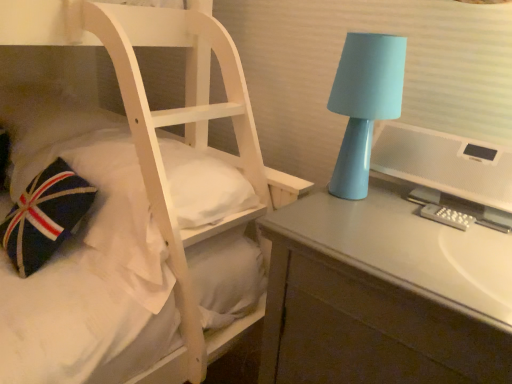
What do you see at coordinates (446, 165) in the screenshot? I see `white textured computer monitor at right` at bounding box center [446, 165].

Find the location of a particular element. white textured computer monitor at right is located at coordinates (446, 165).

Are matte gray desk at right and white textured computer monitor at right located far from each other?

No, there isn't a large distance between matte gray desk at right and white textured computer monitor at right.

Is matte gray desk at right facing towards white textured computer monitor at right?

No, matte gray desk at right is not facing towards white textured computer monitor at right.

In the image, is matte gray desk at right positioned in front of or behind white textured computer monitor at right?

matte gray desk at right is positioned closer to the viewer than white textured computer monitor at right.

Based on the photo, is matte gray desk at right inside white textured computer monitor at right?

No, matte gray desk at right is not a part of white textured computer monitor at right.

Which object is thinner, white textured computer monitor at right or matte gray desk at right?

white textured computer monitor at right.

Where is `computer monitor that appears on the right of matte gray desk at right`? computer monitor that appears on the right of matte gray desk at right is located at coordinates (446, 165).

Is matte blue lamp at right oriented towards white textured computer monitor at right?

No, matte blue lamp at right is not facing towards white textured computer monitor at right.

Which object is further away from the camera, matte blue lamp at right or white textured computer monitor at right?

Positioned behind is matte blue lamp at right.

Considering the positions of objects matte blue lamp at right and white textured computer monitor at right in the image provided, who is more to the left, matte blue lamp at right or white textured computer monitor at right?

matte blue lamp at right.

Between point (451, 170) and point (369, 75), which one is positioned in front?

Positioned in front is point (369, 75).

At what (x,y) coordinates should I click in order to perform the action: click on lamp on the left of white textured computer monitor at right. Please return your answer as a coordinate pair (x, y). Looking at the image, I should click on (364, 104).

Is white textured computer monitor at right oriented towards matte blue lamp at right?

No, white textured computer monitor at right is not turned towards matte blue lamp at right.

Between matte blue lamp at right and matte gray desk at right, which one appears on the right side from the viewer's perspective?

Positioned to the right is matte gray desk at right.

Is matte blue lamp at right not within matte gray desk at right?

Yes.

This screenshot has height=384, width=512. Find the location of `desk below the matte blue lamp at right (from the image's perspective)`. desk below the matte blue lamp at right (from the image's perspective) is located at coordinates (384, 295).

Can you confirm if matte blue lamp at right is thinner than matte gray desk at right?

Correct, the width of matte blue lamp at right is less than that of matte gray desk at right.

Choose the correct answer: Is matte gray desk at right inside matte blue lamp at right or outside it?

matte gray desk at right cannot be found inside matte blue lamp at right.

From a real-world perspective, which is physically above, matte gray desk at right or matte blue lamp at right?

matte blue lamp at right is physically above.

Can you confirm if matte gray desk at right is taller than matte blue lamp at right?

Indeed, matte gray desk at right has a greater height compared to matte blue lamp at right.

Identify the location of desk below the white textured computer monitor at right (from the image's perspective). (384, 295).

Identify the location of desk below the white textured computer monitor at right (from a real-world perspective). (384, 295).

Looking at this image, estimate the real-world distances between objects in this image. Which object is further from matte gray desk at right, matte blue lamp at right or white textured computer monitor at right?

Among the two, matte blue lamp at right is located further to matte gray desk at right.

When comparing their distances from white textured computer monitor at right, does matte gray desk at right or matte blue lamp at right seem further?

matte gray desk at right lies further to white textured computer monitor at right than the other object.

Consider the image. From the image, which object appears to be nearer to matte gray desk at right, white textured computer monitor at right or matte blue lamp at right?

The object closer to matte gray desk at right is white textured computer monitor at right.

Looking at this image, estimate the real-world distances between objects in this image. Which object is closer to matte blue lamp at right, matte gray desk at right or white textured computer monitor at right?

white textured computer monitor at right is positioned closer to the anchor matte blue lamp at right.

Considering their positions, is matte blue lamp at right positioned further to white textured computer monitor at right than matte gray desk at right?

The object further to white textured computer monitor at right is matte gray desk at right.

Based on their spatial positions, is white textured computer monitor at right or matte gray desk at right further from matte blue lamp at right?

matte gray desk at right is further to matte blue lamp at right.

Identify the location of computer monitor between matte blue lamp at right and matte gray desk at right in the vertical direction. This screenshot has height=384, width=512. (446, 165).